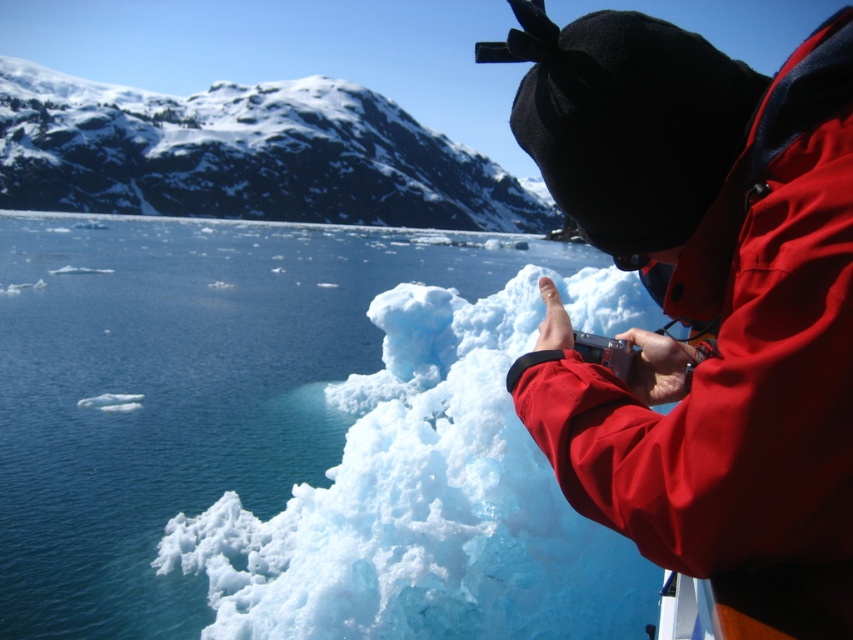
Question: Estimate the real-world distances between objects in this image. Which object is closer to the white ice at upper left?

Choices:
 (A) transparent blue water at center
 (B) matte red jacket at center

Answer: (A)

Question: Does matte red jacket at center lie in front of white ice at upper left?

Choices:
 (A) yes
 (B) no

Answer: (A)

Question: Among these objects, which one is farthest from the camera?

Choices:
 (A) white ice at upper left
 (B) transparent blue water at center

Answer: (A)

Question: Does transparent blue water at center have a greater width compared to matte red jacket at center?

Choices:
 (A) yes
 (B) no

Answer: (A)

Question: Which point is closer to the camera?

Choices:
 (A) (68, 125)
 (B) (543, 460)
 (C) (787, 589)

Answer: (C)

Question: Does matte red jacket at center appear on the left side of white ice at upper left?

Choices:
 (A) no
 (B) yes

Answer: (A)